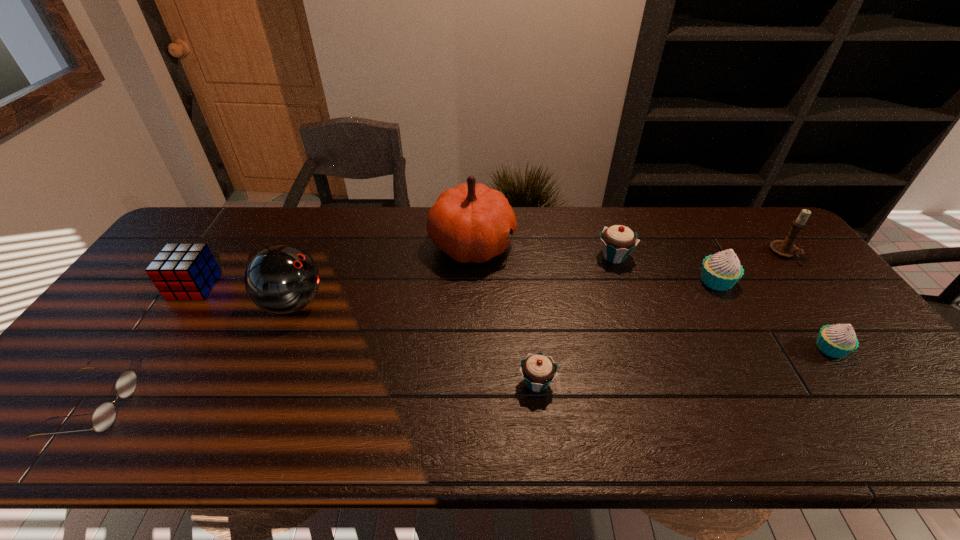
Locate an element on the screen. The width and height of the screenshot is (960, 540). spectacles that is at the left edge is located at coordinates (103, 417).

The image size is (960, 540). I want to click on candle holder that is at the right edge, so click(x=785, y=248).

Where is `cupcake that is at the right edge`? The width and height of the screenshot is (960, 540). cupcake that is at the right edge is located at coordinates (839, 340).

Locate an element on the screen. This screenshot has width=960, height=540. object at the near left corner is located at coordinates (103, 417).

Locate an element on the screen. This screenshot has height=540, width=960. object at the far right corner is located at coordinates (785, 248).

In the image, there is a desktop. Where is `vacant region at the far edge`? The image size is (960, 540). vacant region at the far edge is located at coordinates (656, 225).

Locate an element on the screen. vacant area at the near edge of the desktop is located at coordinates (768, 413).

Locate an element on the screen. The height and width of the screenshot is (540, 960). blank area at the left edge is located at coordinates (143, 355).

You are a GUI agent. You are given a task and a screenshot of the screen. Output one action in this format:
    pyautogui.click(x=<x>, y=<y>)
    Task: Click on the free spot at the right edge of the desktop
    
    Given the screenshot: What is the action you would take?
    pyautogui.click(x=795, y=282)

Identify the location of vacant space at the near left corner of the desktop. The height and width of the screenshot is (540, 960). point(86,434).